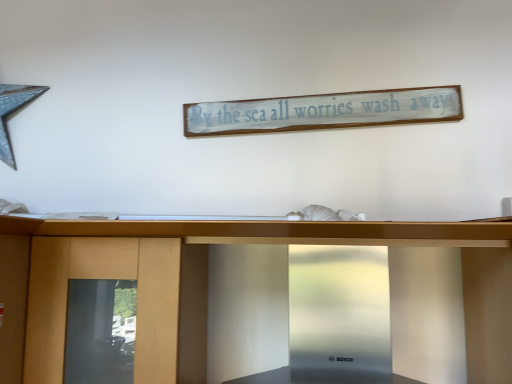
What is the approximate width of stainless steel range hood at center?

stainless steel range hood at center is 23.48 inches wide.

You are a GUI agent. You are given a task and a screenshot of the screen. Output one action in this format:
    pyautogui.click(x=<x>, y=<y>)
    Task: Click on the stainless steel range hood at center
    This screenshot has width=512, height=384.
    Given the screenshot: What is the action you would take?
    coord(262,242)

This screenshot has height=384, width=512. What do you see at coordinates (262, 242) in the screenshot? I see `stainless steel range hood at center` at bounding box center [262, 242].

Where is `white distressed wood signboard at upper center`? white distressed wood signboard at upper center is located at coordinates (324, 111).

Measure the distance between point (x=212, y=118) and camera.

The distance of point (x=212, y=118) from camera is 4.71 feet.

What do you see at coordinates (324, 111) in the screenshot? The width and height of the screenshot is (512, 384). I see `white distressed wood signboard at upper center` at bounding box center [324, 111].

Where is `stainless steel range hood at center`? The image size is (512, 384). stainless steel range hood at center is located at coordinates (262, 242).

Would you say stainless steel range hood at center is to the left or to the right of white distressed wood signboard at upper center in the picture?

stainless steel range hood at center is to the left of white distressed wood signboard at upper center.

From the picture: Is stainless steel range hood at center in front of white distressed wood signboard at upper center?

That is True.

Does point (185, 271) appear closer or farther from the camera than point (272, 101)?

Point (185, 271) is closer to the camera than point (272, 101).

From the image's perspective, which one is positioned lower, stainless steel range hood at center or white distressed wood signboard at upper center?

stainless steel range hood at center, from the image's perspective.

From a real-world perspective, is stainless steel range hood at center located higher than white distressed wood signboard at upper center?

No.

Which object is wider, stainless steel range hood at center or white distressed wood signboard at upper center?

stainless steel range hood at center is wider.

In the scene shown: Considering the sizes of stainless steel range hood at center and white distressed wood signboard at upper center in the image, is stainless steel range hood at center taller or shorter than white distressed wood signboard at upper center?

stainless steel range hood at center is taller than white distressed wood signboard at upper center.

Does stainless steel range hood at center have a larger size compared to white distressed wood signboard at upper center?

Yes, stainless steel range hood at center is bigger than white distressed wood signboard at upper center.

Do you think stainless steel range hood at center is within white distressed wood signboard at upper center, or outside of it?

stainless steel range hood at center is not inside white distressed wood signboard at upper center, it's outside.

Is stainless steel range hood at center touching white distressed wood signboard at upper center?

No, stainless steel range hood at center is not beside white distressed wood signboard at upper center.

Is stainless steel range hood at center oriented away from white distressed wood signboard at upper center?

stainless steel range hood at center is not turned away from white distressed wood signboard at upper center.

How different are the orientations of stainless steel range hood at center and white distressed wood signboard at upper center in degrees?

0.498 degrees.

How far apart are stainless steel range hood at center and white distressed wood signboard at upper center?

stainless steel range hood at center is 21.53 inches from white distressed wood signboard at upper center.

At what (x,y) coordinates should I click in order to perform the action: click on furniture that is on the left side of white distressed wood signboard at upper center. Please return your answer as a coordinate pair (x, y). Looking at the image, I should click on (262, 242).

Is white distressed wood signboard at upper center at the left side of stainless steel range hood at center?

In fact, white distressed wood signboard at upper center is to the right of stainless steel range hood at center.

Is white distressed wood signboard at upper center further to the viewer compared to stainless steel range hood at center?

Yes, it is behind stainless steel range hood at center.

Looking at this image, which is closer, (366, 115) or (386, 228)?

Point (366, 115).

Based on the photo, from the image's perspective, is white distressed wood signboard at upper center over stainless steel range hood at center?

Yes, from the image's perspective, white distressed wood signboard at upper center is over stainless steel range hood at center.

From a real-world perspective, which is physically above, white distressed wood signboard at upper center or stainless steel range hood at center?

white distressed wood signboard at upper center, from a real-world perspective.

Which of these two, white distressed wood signboard at upper center or stainless steel range hood at center, is thinner?

white distressed wood signboard at upper center is thinner.

Can you confirm if white distressed wood signboard at upper center is taller than stainless steel range hood at center?

In fact, white distressed wood signboard at upper center may be shorter than stainless steel range hood at center.

Based on the photo, is white distressed wood signboard at upper center bigger or smaller than stainless steel range hood at center?

Clearly, white distressed wood signboard at upper center is smaller in size than stainless steel range hood at center.

Is white distressed wood signboard at upper center inside the boundaries of stainless steel range hood at center, or outside?

white distressed wood signboard at upper center is outside stainless steel range hood at center.

Is white distressed wood signboard at upper center far away from stainless steel range hood at center?

They are positioned close to each other.

Is white distressed wood signboard at upper center facing towards stainless steel range hood at center?

No, white distressed wood signboard at upper center does not turn towards stainless steel range hood at center.

How many degrees apart are the facing directions of white distressed wood signboard at upper center and stainless steel range hood at center?

white distressed wood signboard at upper center and stainless steel range hood at center are facing 0.498 degrees away from each other.

This screenshot has height=384, width=512. I want to click on bulletin board that appears behind the stainless steel range hood at center, so click(324, 111).

Identify the location of bulletin board above the stainless steel range hood at center (from the image's perspective). (324, 111).

Identify the location of furniture below the white distressed wood signboard at upper center (from a real-world perspective). (262, 242).